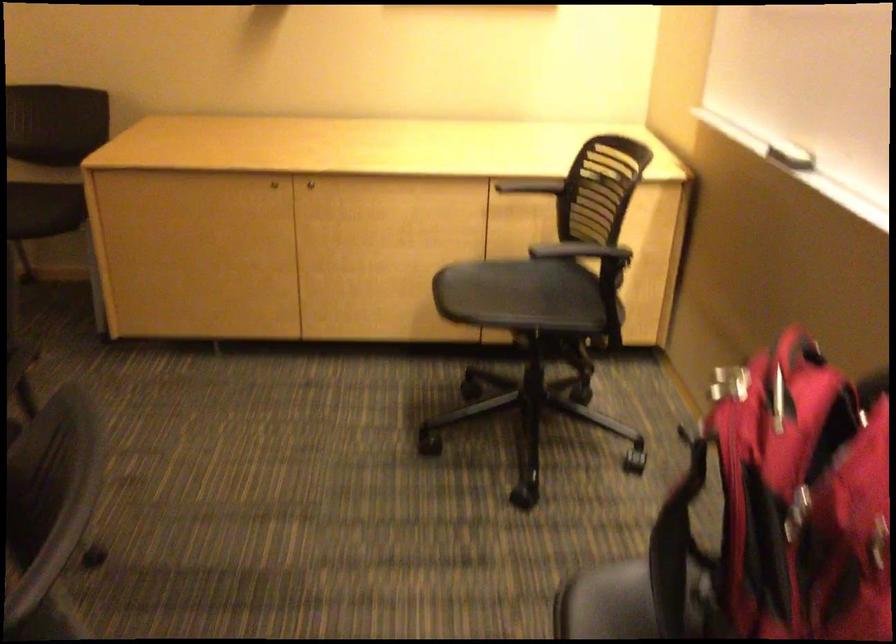
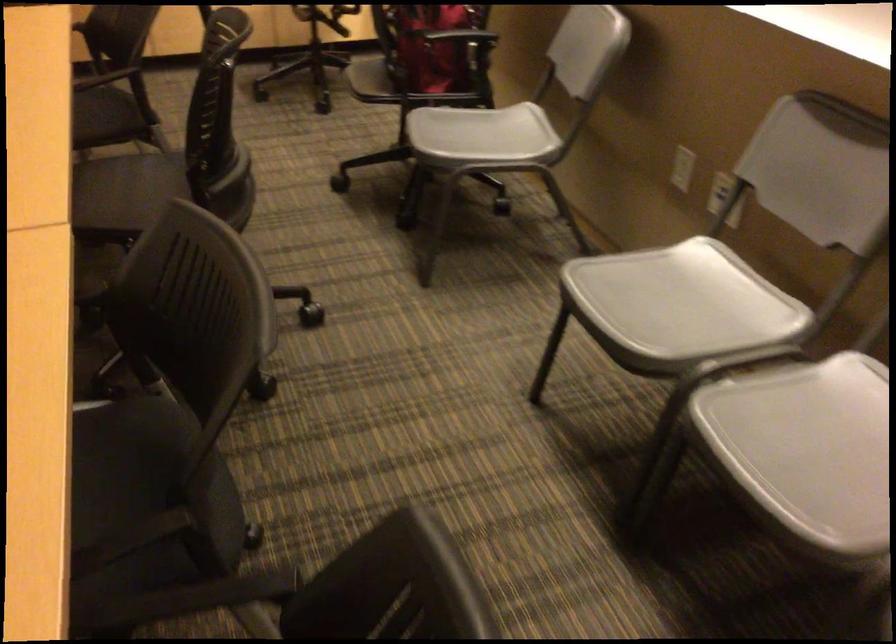
Question: In a continuous first-person perspective shot, in which direction is the camera moving?

Choices:
 (A) Left
 (B) Right
 (C) Forward
 (D) Backward

Answer: (D)